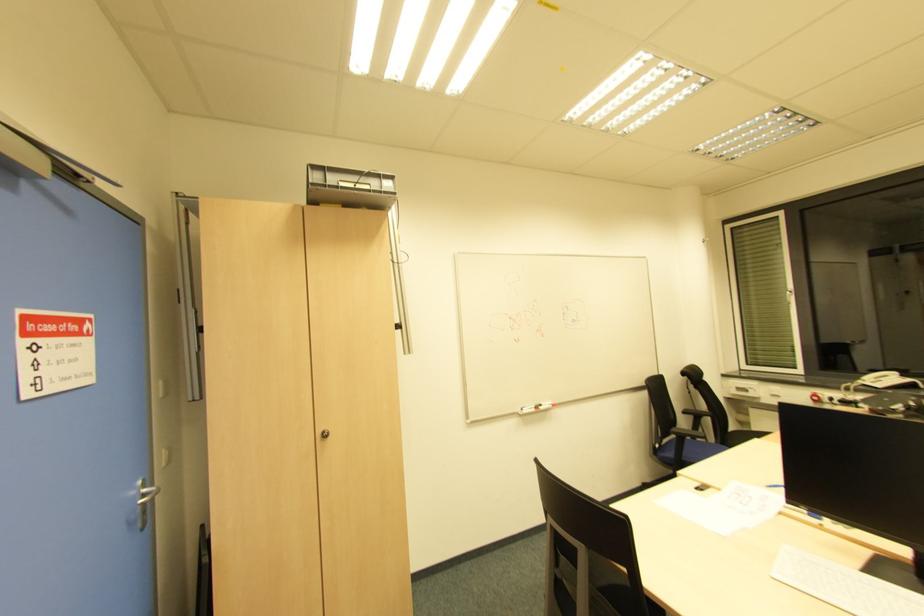
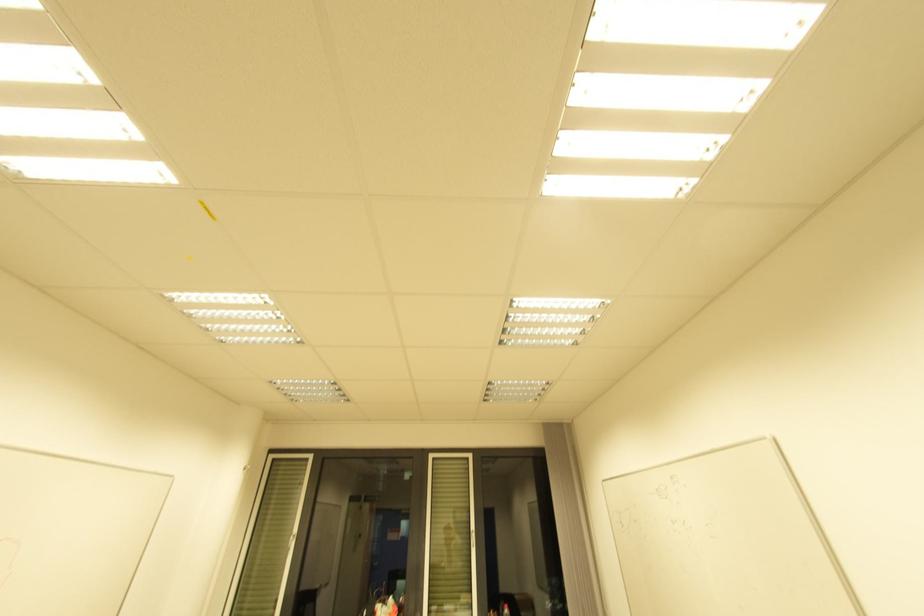
The images are taken continuously from a first-person perspective. In which direction is your viewpoint rotating?

The camera rotated toward right-up.